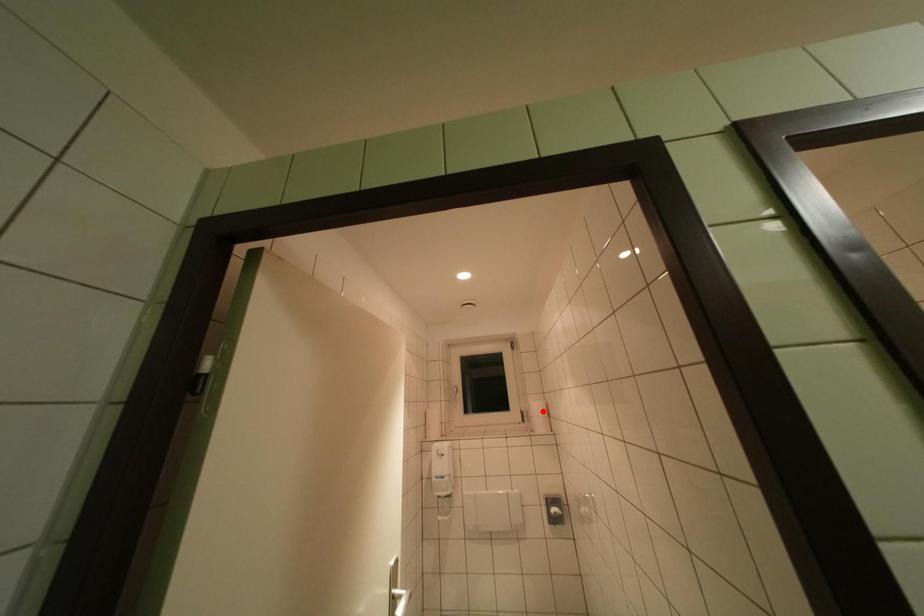
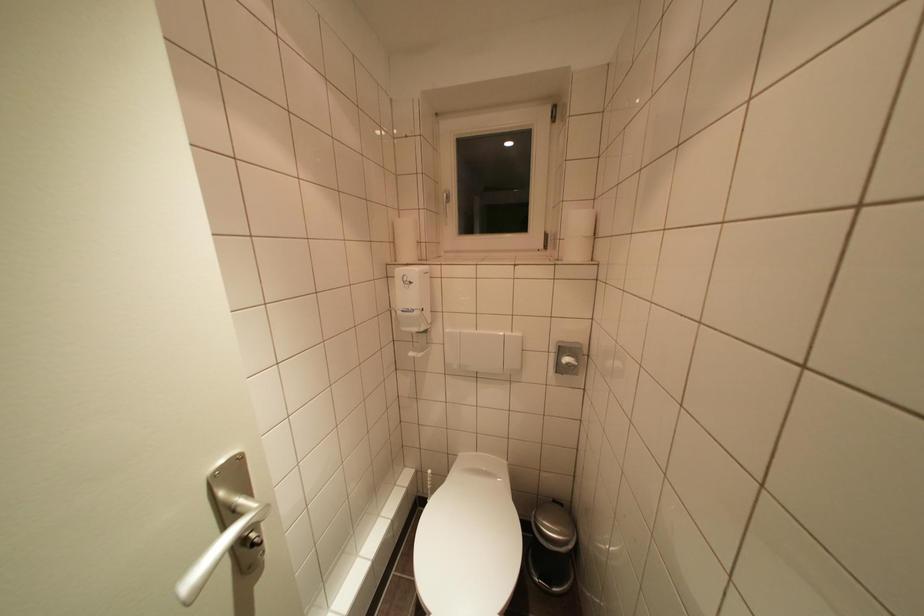
Locate, in the second image, the point that corresponds to the highlighted location in the first image.

(581, 225)